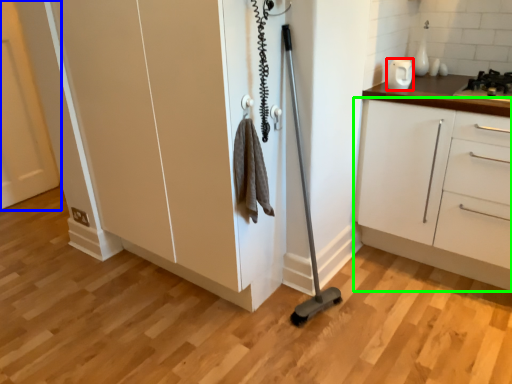
Question: Which is farther away from appliance (highlighted by a red box)? door (highlighted by a blue box) or cabinetry (highlighted by a green box)?

Choices:
 (A) door
 (B) cabinetry

Answer: (A)